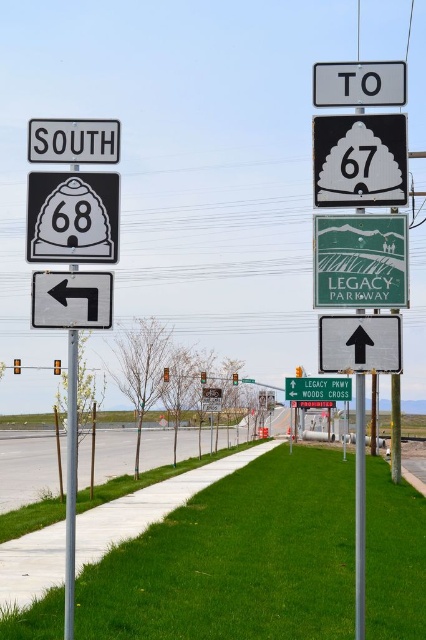
Does white plastic sign at upper left appear on the right side of green matte sign at upper center?

In fact, white plastic sign at upper left is to the left of green matte sign at upper center.

Who is more distant from viewer, [69,154] or [293,396]?

The point [293,396] is more distant.

The height and width of the screenshot is (640, 426). Identify the location of white plastic sign at upper left. (72, 140).

Is green grass at center bigger than green matte sign at center?

Yes, green grass at center is bigger than green matte sign at center.

Does green grass at center appear over green matte sign at center?

No, green grass at center is not above green matte sign at center.

Describe the element at coordinates (236, 561) in the screenshot. I see `green grass at center` at that location.

You are a GUI agent. You are given a task and a screenshot of the screen. Output one action in this format:
    pyautogui.click(x=<x>, y=<y>)
    Task: Click on the green grass at center
    Image resolution: width=426 pixels, height=640 pixels.
    Given the screenshot: What is the action you would take?
    pyautogui.click(x=236, y=561)

Between white plastic sign at upper left and metallic pole at center, which one has more height?

metallic pole at center is taller.

Does white plastic sign at upper left lie behind metallic pole at center?

Yes, it is.

Locate an element on the screen. Image resolution: width=426 pixels, height=640 pixels. white plastic sign at upper left is located at coordinates click(x=72, y=140).